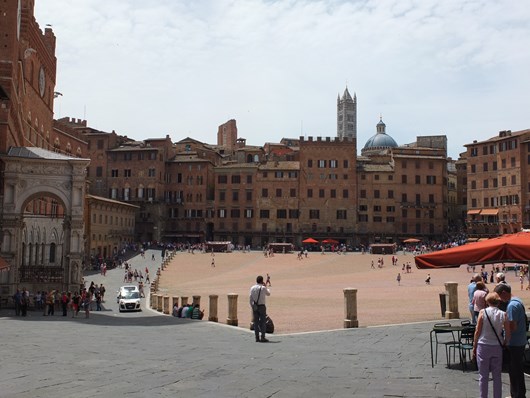
The width and height of the screenshot is (530, 398). Find the location of `chairs`. chairs is located at coordinates (464, 342), (445, 345), (466, 323).